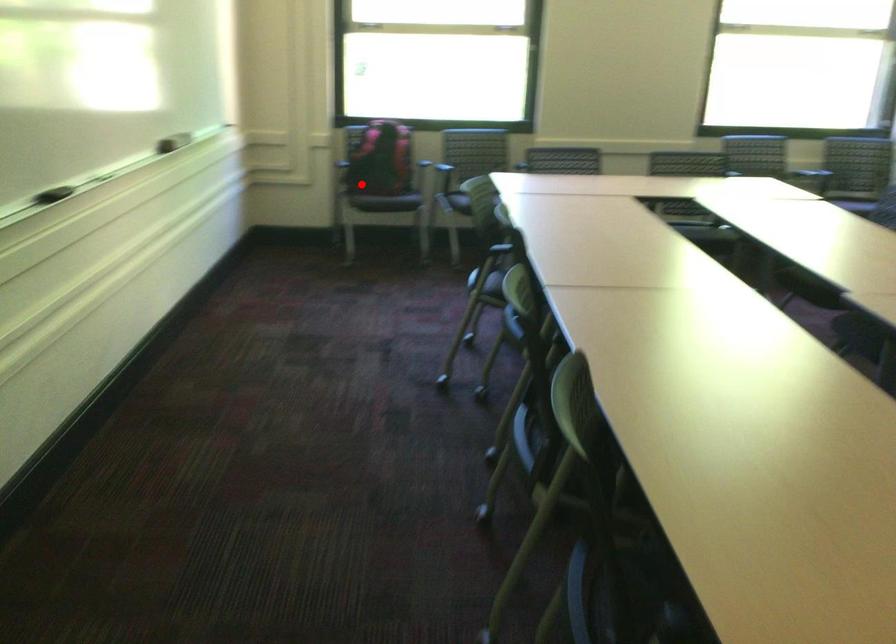
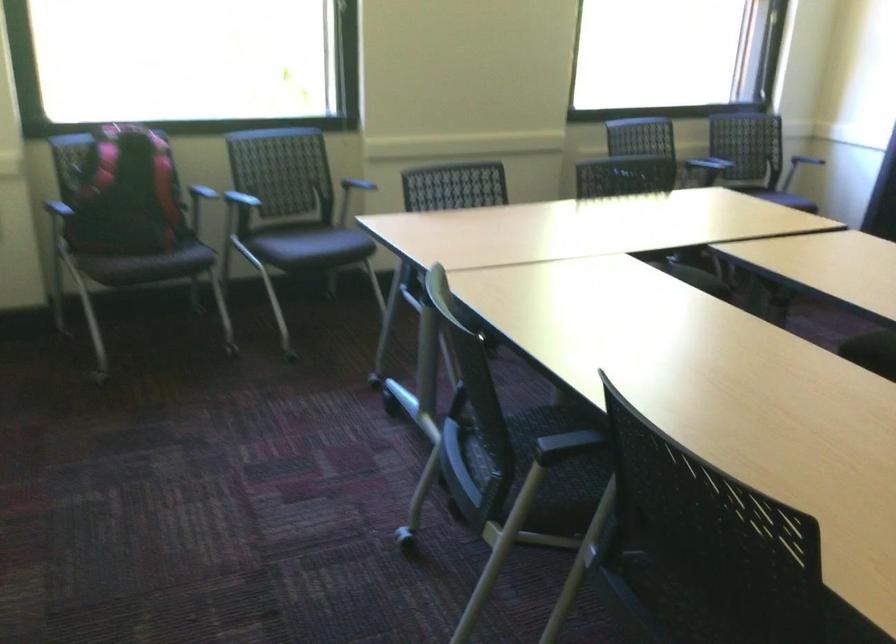
Question: I am providing you with two images of the same scene from different viewpoints. A red point is shown in image1. For the corresponding object point in image2, is it positioned nearer or farther from the camera?

Choices:
 (A) Nearer
 (B) Farther

Answer: (A)